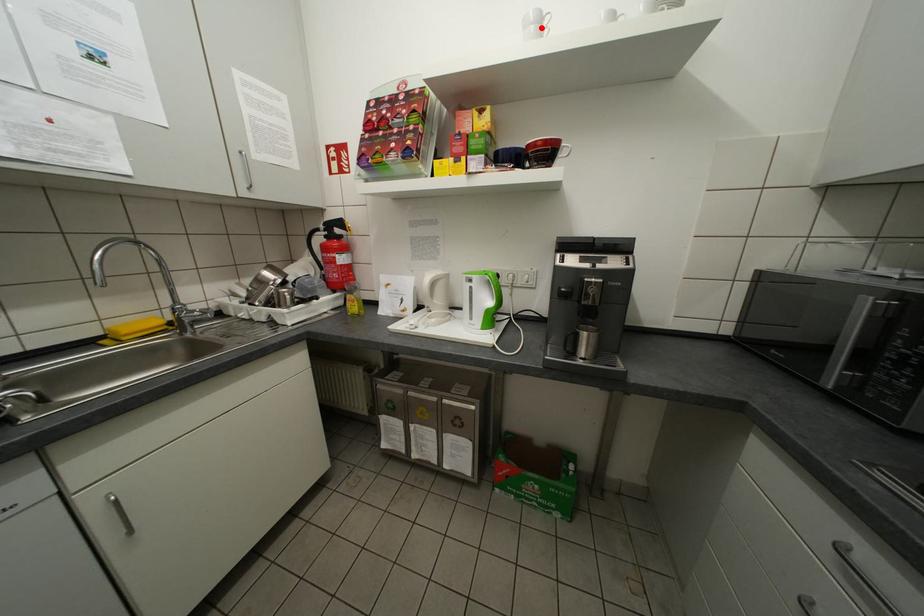
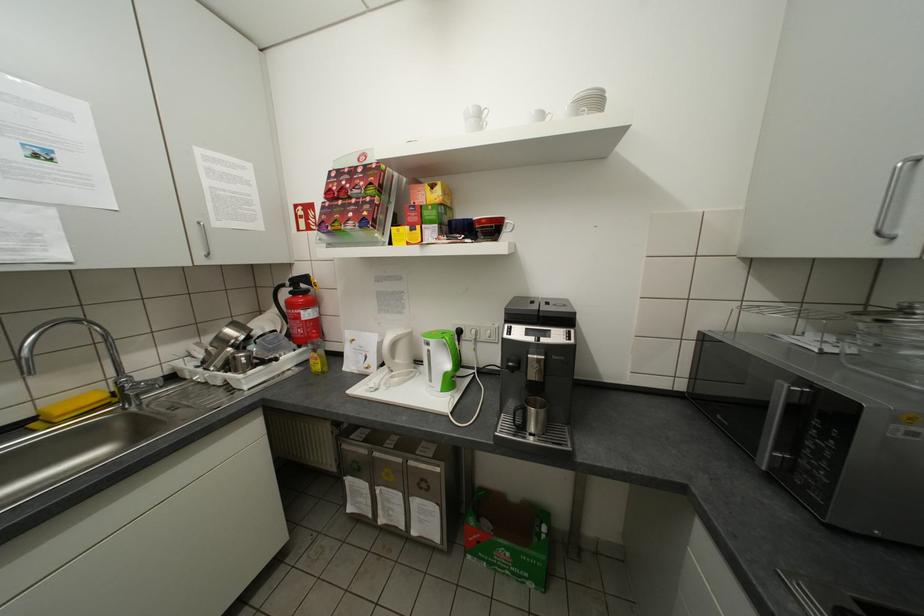
Find the pixel in the second image that matches the highlighted location in the first image.

(481, 120)